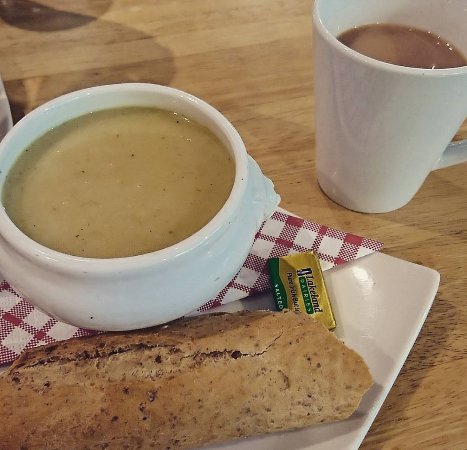
Where is `square plate`? This screenshot has width=467, height=450. square plate is located at coordinates (397, 308).